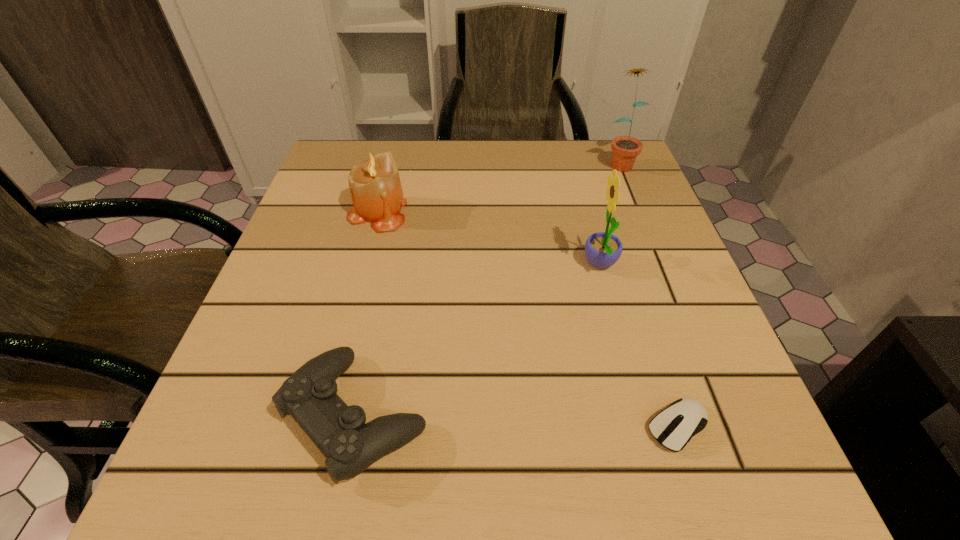
Locate an element on the screen. The image size is (960, 540). control present at the left edge is located at coordinates coord(309,395).

Where is `mouse situated at the right edge`? This screenshot has width=960, height=540. mouse situated at the right edge is located at coordinates click(x=673, y=427).

Image resolution: width=960 pixels, height=540 pixels. I want to click on object that is at the far left corner, so click(x=375, y=187).

At what (x,y) coordinates should I click in order to perform the action: click on object located in the near left corner section of the desktop. Please return your answer as a coordinate pair (x, y). This screenshot has width=960, height=540. Looking at the image, I should click on (309, 395).

You are a GUI agent. You are given a task and a screenshot of the screen. Output one action in this format:
    pyautogui.click(x=<x>, y=<y>)
    Task: Click on the object present at the far right corner
    Image resolution: width=960 pixels, height=540 pixels.
    Given the screenshot: What is the action you would take?
    pyautogui.click(x=625, y=149)

The height and width of the screenshot is (540, 960). In order to click on object located at the near right corner in this screenshot , I will do `click(673, 427)`.

Locate an element on the screen. This screenshot has height=540, width=960. free location at the far edge is located at coordinates (458, 192).

Locate an element on the screen. Image resolution: width=960 pixels, height=540 pixels. free region at the near edge of the desktop is located at coordinates (522, 457).

You are a GUI agent. You are given a task and a screenshot of the screen. Output one action in this format:
    pyautogui.click(x=<x>, y=<y>)
    Task: Click on the free space at the left edge of the desktop
    The width and height of the screenshot is (960, 540).
    Given the screenshot: What is the action you would take?
    click(345, 319)

The height and width of the screenshot is (540, 960). Identify the location of free region at the right edge of the desktop. (591, 202).